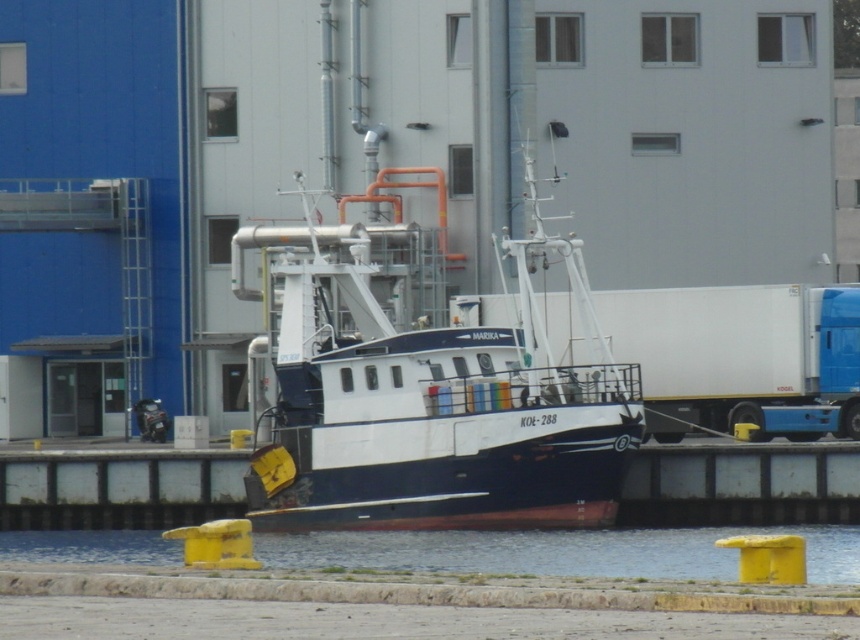
Is white matte boat at center shorter than white matte truck at center?

In fact, white matte boat at center may be taller than white matte truck at center.

Does white matte boat at center have a smaller size compared to white matte truck at center?

Actually, white matte boat at center might be larger than white matte truck at center.

Does point (489, 461) come farther from viewer compared to point (789, 353)?

No, (489, 461) is closer to viewer.

Identify the location of white matte boat at center. The width and height of the screenshot is (860, 640). (431, 396).

Does white matte truck at center have a lesser height compared to transparent water at lower center?

Yes, white matte truck at center is shorter than transparent water at lower center.

You are a GUI agent. You are given a task and a screenshot of the screen. Output one action in this format:
    pyautogui.click(x=<x>, y=<y>)
    Task: Click on the white matte truck at center
    The height and width of the screenshot is (640, 860).
    Given the screenshot: What is the action you would take?
    pyautogui.click(x=740, y=356)

In order to click on white matte truck at center in this screenshot , I will do `click(740, 356)`.

Measure the distance between white matte boat at center and transparent water at lower center.

white matte boat at center and transparent water at lower center are 4.85 meters apart from each other.

In the scene shown: Is white matte boat at center bigger than transparent water at lower center?

Indeed, white matte boat at center has a larger size compared to transparent water at lower center.

The height and width of the screenshot is (640, 860). Describe the element at coordinates (431, 396) in the screenshot. I see `white matte boat at center` at that location.

This screenshot has height=640, width=860. Find the location of `white matte boat at center`. white matte boat at center is located at coordinates (431, 396).